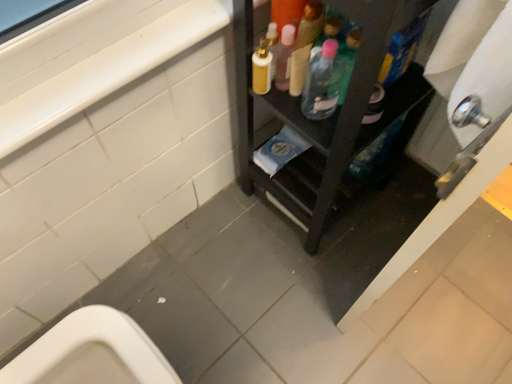
At what (x,y) coordinates should I click in order to perform the action: click on free location to the right of black wood shelf at center. Please return your answer as a coordinate pair (x, y). The image size is (512, 384). Looking at the image, I should click on (401, 218).